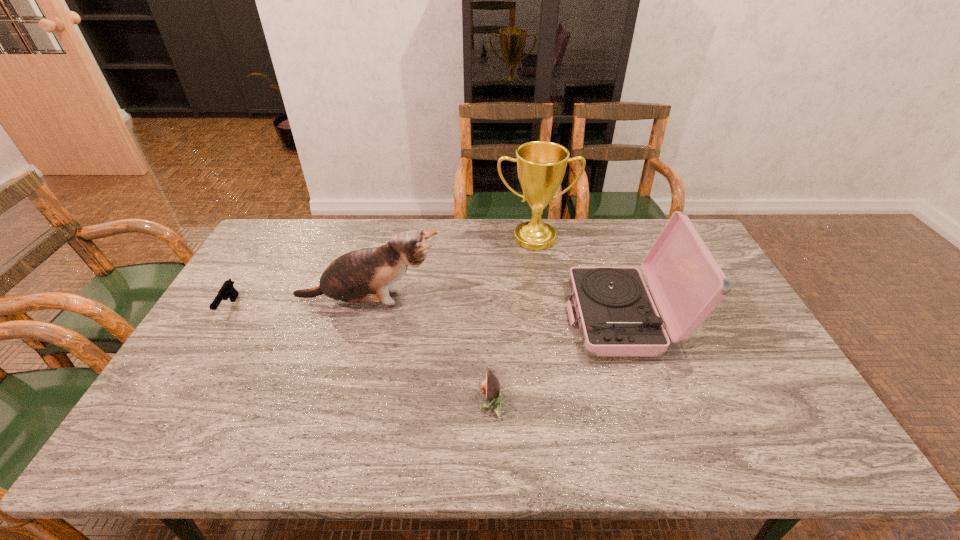
Image resolution: width=960 pixels, height=540 pixels. What are the coordinates of `free space at the near edge of the desktop` in the screenshot? It's located at (510, 445).

At what (x,y) coordinates should I click in order to perform the action: click on free spot at the left edge of the desktop. Please return your answer as a coordinate pair (x, y). The height and width of the screenshot is (540, 960). Looking at the image, I should click on (225, 372).

Where is `free space at the near left corner of the desktop`? The image size is (960, 540). free space at the near left corner of the desktop is located at coordinates (171, 436).

Image resolution: width=960 pixels, height=540 pixels. Identify the location of vacant region between the record player and the cat. (496, 309).

This screenshot has height=540, width=960. I want to click on empty space between the record player and the leftmost object, so click(x=426, y=313).

Find the location of a particular element. The width and height of the screenshot is (960, 540). free space between the nearest object and the tallest object is located at coordinates point(513,320).

Where is `free space between the record player and the shortest object`? The height and width of the screenshot is (540, 960). free space between the record player and the shortest object is located at coordinates (426, 313).

Image resolution: width=960 pixels, height=540 pixels. I want to click on vacant space in between the pistol and the record player, so click(426, 313).

At what (x,y) coordinates should I click in order to perform the action: click on vacant point located between the record player and the second shortest object. Please return your answer as a coordinate pair (x, y). This screenshot has height=540, width=960. Looking at the image, I should click on (557, 360).

At what (x,y) coordinates should I click in order to perform the action: click on free space between the pistol and the second object from left to right. Please return your answer as a coordinate pair (x, y). Image resolution: width=960 pixels, height=540 pixels. Looking at the image, I should click on (299, 303).